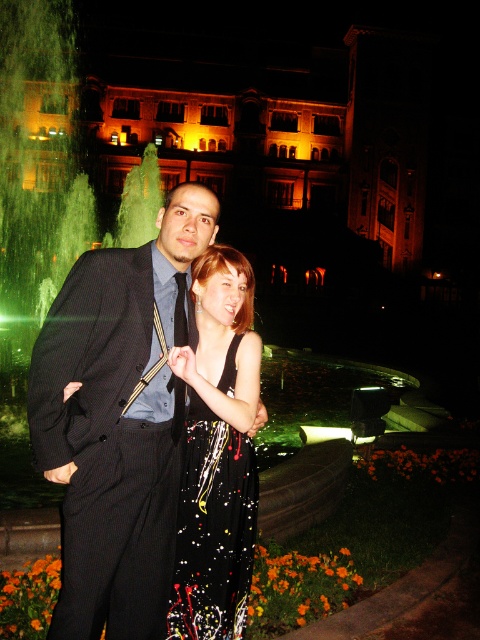
Is black pinstripe suit at center to the left of sparkly black dress at center from the viewer's perspective?

Yes, black pinstripe suit at center is to the left of sparkly black dress at center.

Is point (140, 397) positioned after point (224, 589)?

Yes, it is.

Does point (170, 337) come closer to viewer compared to point (199, 595)?

No, it is behind (199, 595).

Find the location of a particular element. The image size is (480, 640). black pinstripe suit at center is located at coordinates pos(119,420).